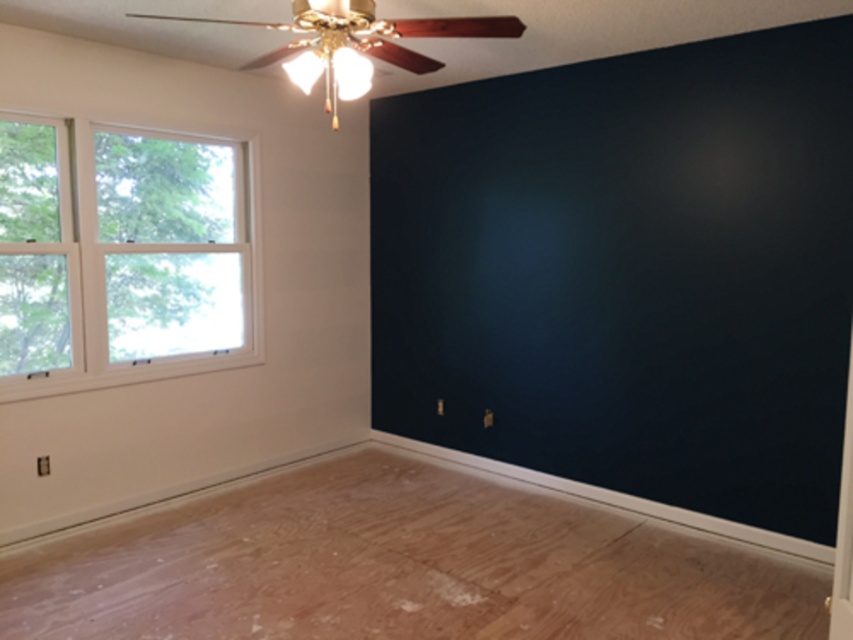
Question: Is natural wood floor at lower center in front of clear glass window at left?

Choices:
 (A) no
 (B) yes

Answer: (B)

Question: Does natural wood floor at lower center appear on the left side of clear glass window at left?

Choices:
 (A) yes
 (B) no

Answer: (B)

Question: Which point is farther from the camera taking this photo?

Choices:
 (A) (86, 285)
 (B) (740, 547)

Answer: (A)

Question: Is natural wood floor at lower center further to the viewer compared to clear glass window at left?

Choices:
 (A) yes
 (B) no

Answer: (B)

Question: Which point is farther from the camera taking this photo?

Choices:
 (A) (660, 563)
 (B) (213, 310)

Answer: (B)